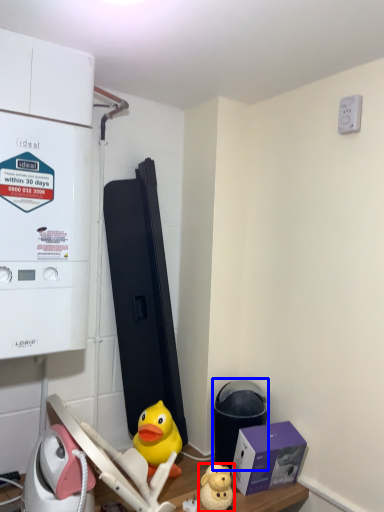
Question: Which object appears closest to the camera in this image, toy (highlighted by a red box) or water heater (highlighted by a blue box)?

Choices:
 (A) toy
 (B) water heater

Answer: (A)